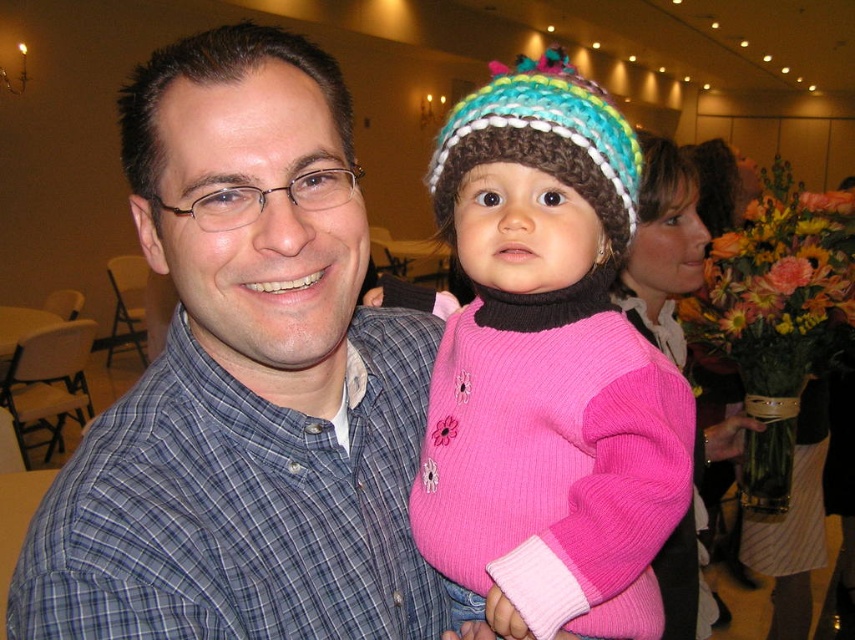
Can you confirm if blue plaid shirt at center is smaller than knitted pink sweater at center?

No.

Does point (134, 140) come behind point (549, 284)?

No, (134, 140) is closer to viewer.

Find the location of a particular element. The width and height of the screenshot is (855, 640). blue plaid shirt at center is located at coordinates (246, 381).

Does knitted pink sweater at center appear over crochet knit hat at center?

Incorrect, knitted pink sweater at center is not positioned above crochet knit hat at center.

Between knitted pink sweater at center and crochet knit hat at center, which one is positioned lower?

Positioned lower is knitted pink sweater at center.

This screenshot has width=855, height=640. Describe the element at coordinates (546, 372) in the screenshot. I see `knitted pink sweater at center` at that location.

What are the coordinates of `knitted pink sweater at center` in the screenshot? It's located at (546, 372).

Can you confirm if blue plaid shirt at center is positioned above crochet knit hat at center?

Incorrect, blue plaid shirt at center is not positioned above crochet knit hat at center.

Identify the location of blue plaid shirt at center. 246,381.